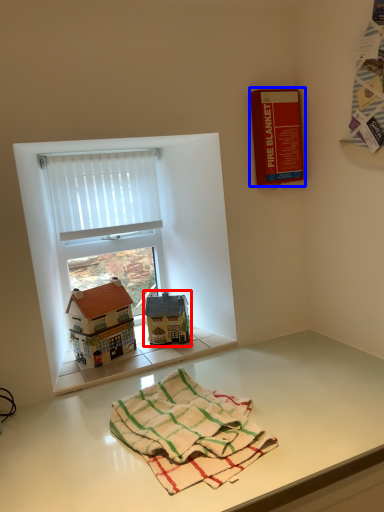
Question: Among these objects, which one is farthest to the camera, toy (highlighted by a red box) or book cover (highlighted by a blue box)?

Choices:
 (A) toy
 (B) book cover

Answer: (A)